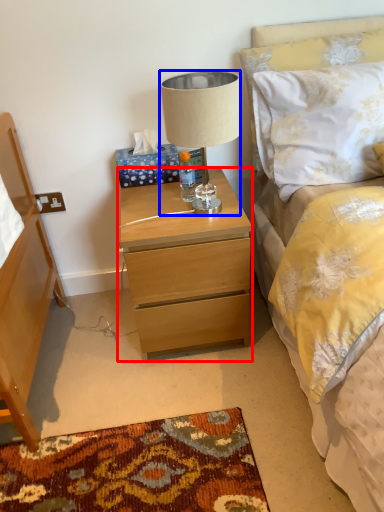
Question: Which object is further to the camera taking this photo, nightstand (highlighted by a red box) or lamp (highlighted by a blue box)?

Choices:
 (A) nightstand
 (B) lamp

Answer: (A)